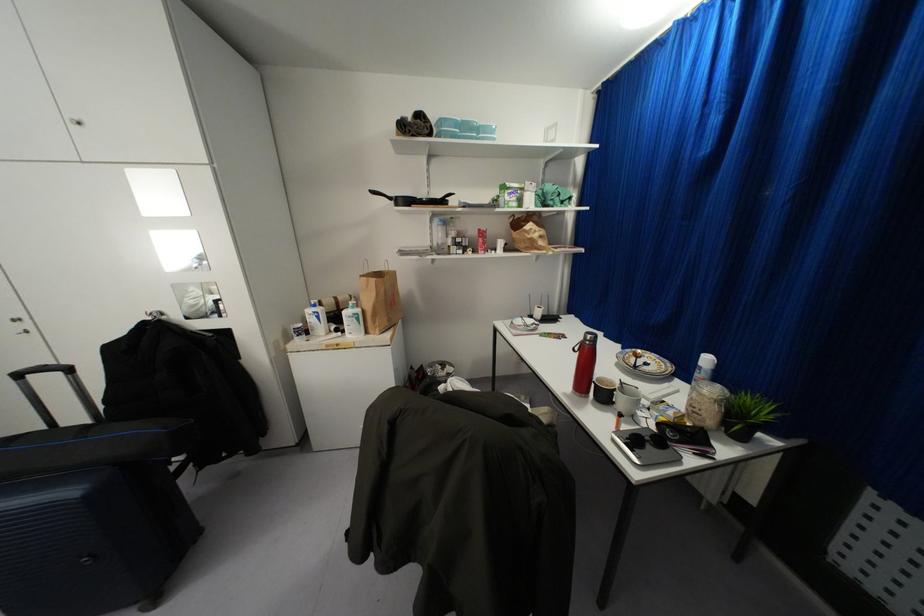
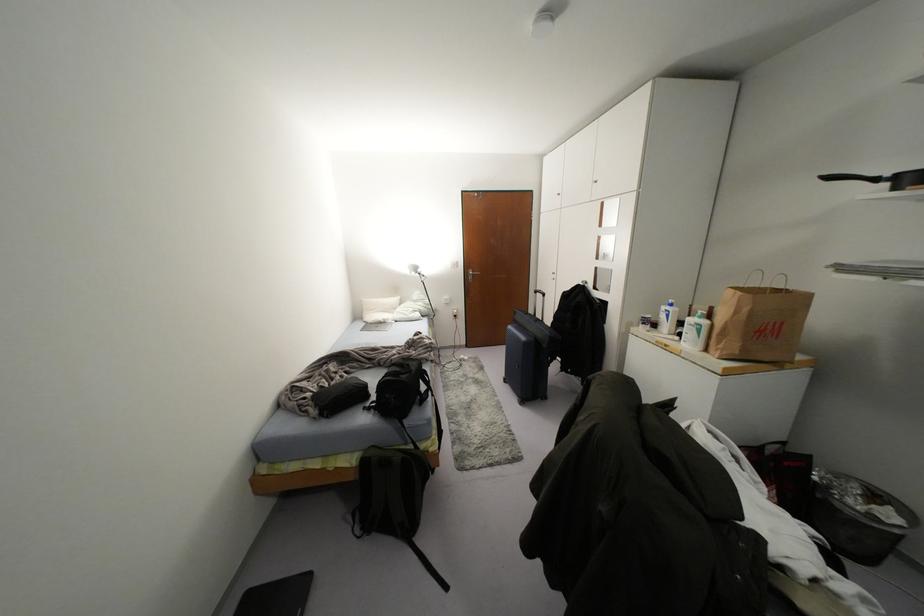
The images are taken continuously from a first-person perspective. In which direction is your viewpoint rotating?

The camera's rotation is toward left-down.